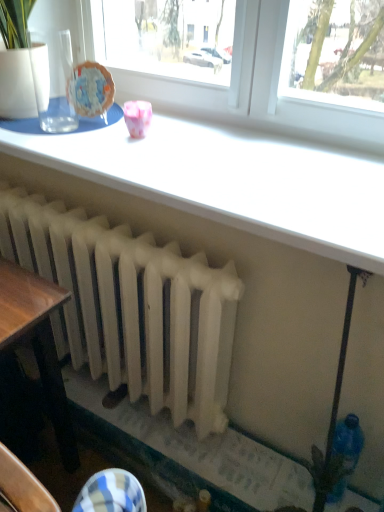
This screenshot has height=512, width=384. Describe the element at coordinates (230, 181) in the screenshot. I see `white glossy table at upper center` at that location.

The width and height of the screenshot is (384, 512). What are the coordinates of `pink glossy cup at upper center` in the screenshot? It's located at (137, 118).

How many degrees apart are the facing directions of white glossy table at upper center and pink glossy cup at upper center?

The angle between the facing direction of white glossy table at upper center and the facing direction of pink glossy cup at upper center is 6.59 degrees.

Which of these two, white glossy table at upper center or pink glossy cup at upper center, is thinner?

pink glossy cup at upper center is thinner.

Is white glossy table at upper center to the right of pink glossy cup at upper center from the viewer's perspective?

Correct, you'll find white glossy table at upper center to the right of pink glossy cup at upper center.

From a real-world perspective, which is physically below, white glossy table at upper center or pink glossy cup at upper center?

white glossy table at upper center.

Is point (150, 109) more distant than point (327, 167)?

Yes, it is behind point (327, 167).

Between pink glossy cup at upper center and white glossy table at upper center, which one has smaller size?

With smaller size is pink glossy cup at upper center.

Could you tell me if pink glossy cup at upper center is turned towards white glossy table at upper center?

No, pink glossy cup at upper center is not facing towards white glossy table at upper center.

Choose the correct answer: Is pink glossy cup at upper center inside white glossy table at upper center or outside it?

pink glossy cup at upper center is located beyond the bounds of white glossy table at upper center.

Considering the relative positions of white matte radiator at center and white glossy table at upper center in the image provided, is white matte radiator at center to the left of white glossy table at upper center from the viewer's perspective?

Yes.

Between white matte radiator at center and white glossy table at upper center, which one has larger size?

white matte radiator at center.

Is white matte radiator at center located outside white glossy table at upper center?

white matte radiator at center lies outside white glossy table at upper center's area.

Is white matte radiator at center further to the viewer compared to white glossy table at upper center?

Yes, the depth of white matte radiator at center is greater than that of white glossy table at upper center.

Consider the image. Is white glossy table at upper center aimed at white matte radiator at center?

No, white glossy table at upper center is not facing towards white matte radiator at center.

Which of these two, white glossy table at upper center or white matte radiator at center, is bigger?

Bigger between the two is white matte radiator at center.

Which is correct: white glossy table at upper center is inside white matte radiator at center, or outside of it?

white glossy table at upper center is outside white matte radiator at center.

Locate an element on the screen. The width and height of the screenshot is (384, 512). table above the white matte radiator at center (from a real-world perspective) is located at coordinates (230, 181).

Is white matte radiator at center oriented away from pink glossy cup at upper center?

No, pink glossy cup at upper center is not at the back of white matte radiator at center.

Find the location of `tableware above the white matte radiator at center (from the image's perspective)`. tableware above the white matte radiator at center (from the image's perspective) is located at coordinates (137, 118).

Can pink glossy cup at upper center be found inside white matte radiator at center?

Definitely not — pink glossy cup at upper center is not inside white matte radiator at center.

From the image's perspective, is pink glossy cup at upper center above or below white matte radiator at center?

Clearly, from the image's perspective, pink glossy cup at upper center is above white matte radiator at center.

Considering the relative positions of pink glossy cup at upper center and white matte radiator at center in the image provided, is pink glossy cup at upper center behind white matte radiator at center?

Yes, pink glossy cup at upper center is further from the camera.

Can you see pink glossy cup at upper center touching white matte radiator at center?

They are not placed beside each other.

The height and width of the screenshot is (512, 384). Identify the location of table on the right of pink glossy cup at upper center. (230, 181).

Image resolution: width=384 pixels, height=512 pixels. I want to click on table in front of the pink glossy cup at upper center, so click(x=230, y=181).

From the image, which object appears to be farther from white glossy table at upper center, white matte radiator at center or pink glossy cup at upper center?

Among the two, white matte radiator at center is located further to white glossy table at upper center.

Considering their positions, is pink glossy cup at upper center positioned further to white glossy table at upper center than white matte radiator at center?

white matte radiator at center.

From the image, which object appears to be farther from pink glossy cup at upper center, white glossy table at upper center or white matte radiator at center?

white matte radiator at center is further to pink glossy cup at upper center.

When comparing their distances from pink glossy cup at upper center, does white matte radiator at center or white glossy table at upper center seem further?

The object further to pink glossy cup at upper center is white matte radiator at center.

From the picture: Considering their positions, is pink glossy cup at upper center positioned closer to white matte radiator at center than white glossy table at upper center?

white glossy table at upper center.

Estimate the real-world distances between objects in this image. Which object is further from white matte radiator at center, white glossy table at upper center or pink glossy cup at upper center?

pink glossy cup at upper center.

Where is `table that lies between pink glossy cup at upper center and white matte radiator at center from top to bottom`? This screenshot has height=512, width=384. table that lies between pink glossy cup at upper center and white matte radiator at center from top to bottom is located at coordinates (230, 181).